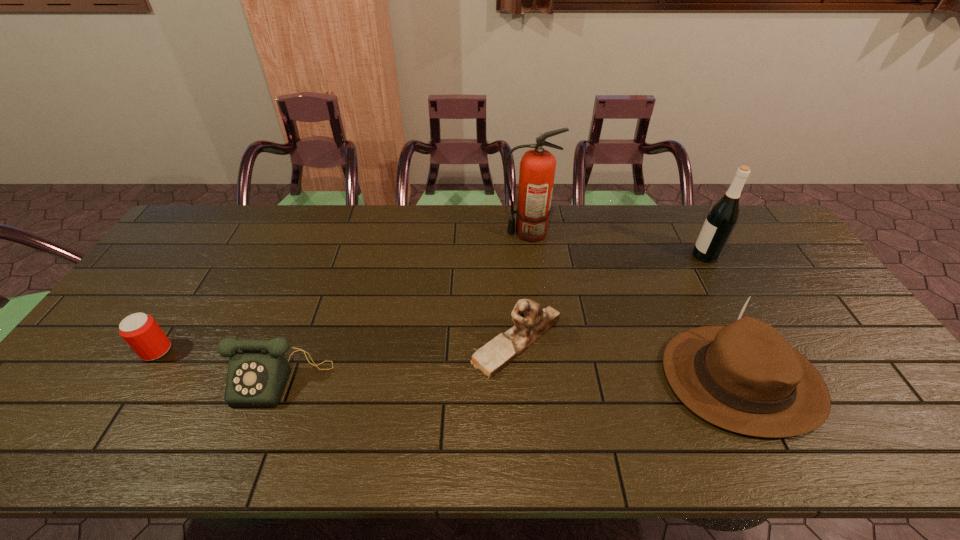
Identify the location of fire extinguisher. This screenshot has height=540, width=960. (537, 167).

The image size is (960, 540). What are the coordinates of `the tallest object` in the screenshot? It's located at (537, 167).

You are a GUI agent. You are given a task and a screenshot of the screen. Output one action in this format:
    pyautogui.click(x=<x>, y=<y>)
    Task: Click on the wine bottle
    The width and height of the screenshot is (960, 540).
    Given the screenshot: What is the action you would take?
    pyautogui.click(x=721, y=220)

This screenshot has width=960, height=540. I want to click on the fifth shortest object, so click(721, 220).

Image resolution: width=960 pixels, height=540 pixels. I want to click on fedora, so click(745, 377).

Find the location of a particular element. figurine is located at coordinates (530, 321).

Image resolution: width=960 pixels, height=540 pixels. I want to click on telephone, so click(258, 370).

The image size is (960, 540). I want to click on the leftmost object, so click(141, 332).

The width and height of the screenshot is (960, 540). Find the location of `free space located on the nozzle of the farthest object`. free space located on the nozzle of the farthest object is located at coordinates (408, 233).

Where is `vacant space located 0.270m on the nozzle of the farthest object`? This screenshot has height=540, width=960. vacant space located 0.270m on the nozzle of the farthest object is located at coordinates (422, 233).